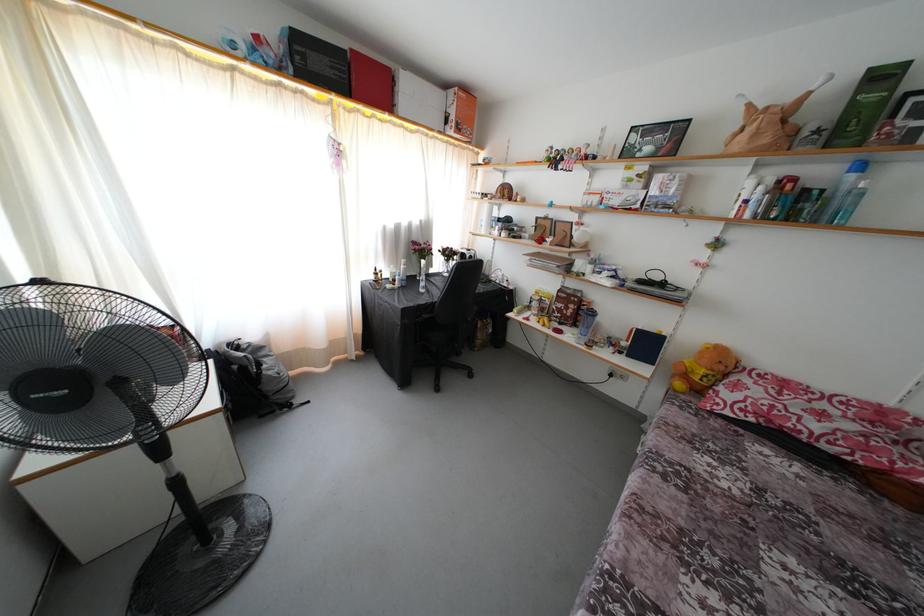
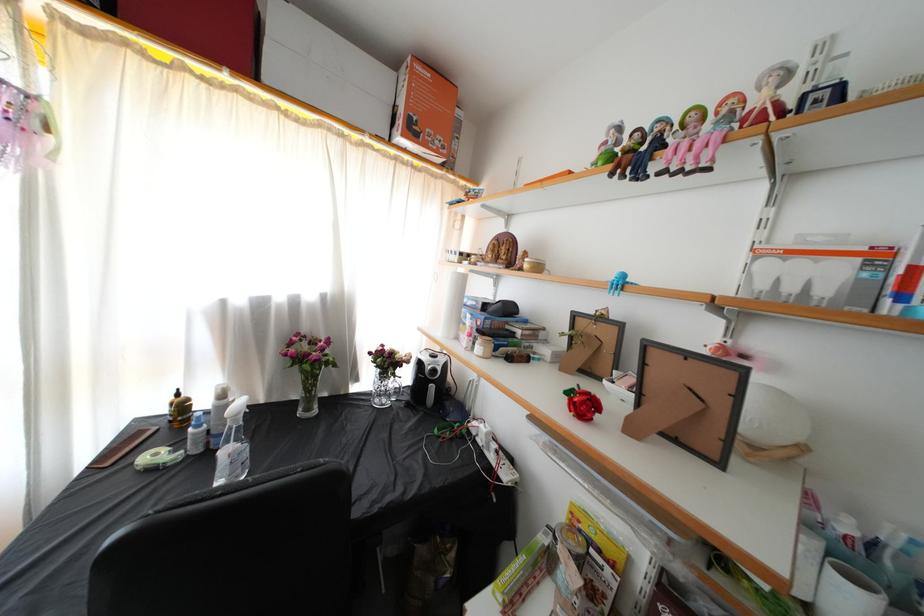
Locate, in the second image, the point that corresponds to (x=478, y=257) in the first image.

(446, 365)